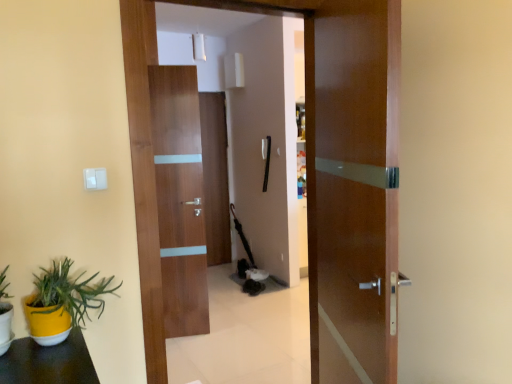
Find the location of a particular element. This screenshot has width=512, height=384. glossy wood door at center, which ranks as the 4th door in back-to-front order is located at coordinates (353, 188).

Measure the distance between point (11, 332) and camera.

A distance of 1.43 meters exists between point (11, 332) and camera.

At what (x,y) coordinates should I click in order to perform the action: click on yellow matte flowerpot at lower left. Please return your answer as a coordinate pair (x, y). The height and width of the screenshot is (384, 512). Looking at the image, I should click on (5, 326).

I want to click on wooden door at center, which is counted as the third door, starting from the back, so click(x=348, y=176).

Describe the element at coordinates (180, 198) in the screenshot. I see `walnut wood door at center, which appears as the 2th door when viewed from the back` at that location.

The height and width of the screenshot is (384, 512). I want to click on yellow matte pot at lower left, so click(x=63, y=302).

Where is `matte wood door at center, positioned as the 4th door in front-to-back order`? The height and width of the screenshot is (384, 512). matte wood door at center, positioned as the 4th door in front-to-back order is located at coordinates (215, 177).

Where is `glossy wood door at center, which ranks as the 4th door in back-to-front order`? This screenshot has height=384, width=512. glossy wood door at center, which ranks as the 4th door in back-to-front order is located at coordinates (353, 188).

Looking at this image, is walnut wood door at center, which appears as the 2th door when viewed from the back, facing away from matte wood door at center, which ranks as the first door in back-to-front order?

walnut wood door at center, which appears as the 2th door when viewed from the back, does not have its back to matte wood door at center, which ranks as the first door in back-to-front order.

In the scene shown: Is walnut wood door at center, acting as the third door starting from the front, in front of matte wood door at center, positioned as the 4th door in front-to-back order?

That is True.

Between walnut wood door at center, acting as the third door starting from the front, and matte wood door at center, which ranks as the first door in back-to-front order, which one appears on the left side from the viewer's perspective?

walnut wood door at center, acting as the third door starting from the front, is more to the left.

Which of these two, glossy wood door at center, which ranks as the 4th door in back-to-front order, or yellow matte flowerpot at lower left, is smaller?

yellow matte flowerpot at lower left is smaller.

Does glossy wood door at center, which ranks as the 4th door in back-to-front order, appear on the left side of yellow matte flowerpot at lower left?

No.

Looking at this image, who is shorter, glossy wood door at center, which ranks as the 4th door in back-to-front order, or yellow matte flowerpot at lower left?

Standing shorter between the two is yellow matte flowerpot at lower left.

From a real-world perspective, who is located higher, glossy wood door at center, arranged as the first door when viewed from the front, or yellow matte flowerpot at lower left?

From a 3D spatial view, glossy wood door at center, arranged as the first door when viewed from the front, is above.

In the image, is matte wood door at center, which ranks as the first door in back-to-front order, on the left side or the right side of wooden door at center, which is counted as the third door, starting from the back?

Based on their positions, matte wood door at center, which ranks as the first door in back-to-front order, is located to the left of wooden door at center, which is counted as the third door, starting from the back.

Which point is more distant from viewer, [209,207] or [355,29]?

Point [209,207]

From the image's perspective, relative to wooden door at center, which is counted as the third door, starting from the back, is matte wood door at center, which ranks as the first door in back-to-front order, above or below?

matte wood door at center, which ranks as the first door in back-to-front order, is situated higher than wooden door at center, which is counted as the third door, starting from the back, in the image.

Considering the relative sizes of matte wood door at center, which ranks as the first door in back-to-front order, and wooden door at center, which is counted as the third door, starting from the back, in the image provided, is matte wood door at center, which ranks as the first door in back-to-front order, shorter than wooden door at center, which is counted as the third door, starting from the back,?

No, matte wood door at center, which ranks as the first door in back-to-front order, is not shorter than wooden door at center, which is counted as the third door, starting from the back.

Looking at this image, considering the relative positions of yellow matte pot at lower left and wooden door at center, the 2th door in the front-to-back sequence, in the image provided, is yellow matte pot at lower left to the right of wooden door at center, the 2th door in the front-to-back sequence, from the viewer's perspective?

No.

In the scene shown: Which object is wider, yellow matte pot at lower left or wooden door at center, which is counted as the third door, starting from the back?

Wider between the two is yellow matte pot at lower left.

How different are the orientations of yellow matte pot at lower left and wooden door at center, the 2th door in the front-to-back sequence, in degrees?

The facing directions of yellow matte pot at lower left and wooden door at center, the 2th door in the front-to-back sequence, are 1.27 degrees apart.

Between yellow matte pot at lower left and wooden door at center, which is counted as the third door, starting from the back, which one has more height?

Standing taller between the two is wooden door at center, which is counted as the third door, starting from the back.

Would you say glossy wood door at center, which ranks as the 4th door in back-to-front order, is outside matte wood door at center, which ranks as the first door in back-to-front order?

Yes, glossy wood door at center, which ranks as the 4th door in back-to-front order, is outside of matte wood door at center, which ranks as the first door in back-to-front order.

From the image's perspective, is glossy wood door at center, arranged as the first door when viewed from the front, on matte wood door at center, positioned as the 4th door in front-to-back order?

No, from the image's perspective, glossy wood door at center, arranged as the first door when viewed from the front, is not on top of matte wood door at center, positioned as the 4th door in front-to-back order.

Considering the sizes of objects glossy wood door at center, arranged as the first door when viewed from the front, and matte wood door at center, positioned as the 4th door in front-to-back order, in the image provided, who is taller, glossy wood door at center, arranged as the first door when viewed from the front, or matte wood door at center, positioned as the 4th door in front-to-back order,?

matte wood door at center, positioned as the 4th door in front-to-back order.

In the scene shown: How distant is glossy wood door at center, which ranks as the 4th door in back-to-front order, from matte wood door at center, positioned as the 4th door in front-to-back order?

glossy wood door at center, which ranks as the 4th door in back-to-front order, is 3.45 meters away from matte wood door at center, positioned as the 4th door in front-to-back order.

Are yellow matte flowerpot at lower left and wooden door at center, which is counted as the third door, starting from the back, located far from each other?

Yes.

Which door is the 1st one when counting from the back of the yellow matte flowerpot at lower left? Please provide its 2D coordinates.

[(348, 176)]

Which is closer to the camera, [7,307] or [384,379]?

Point [7,307].

From a real-world perspective, who is located lower, glossy wood door at center, arranged as the first door when viewed from the front, or walnut wood door at center, which appears as the 2th door when viewed from the back?

walnut wood door at center, which appears as the 2th door when viewed from the back, is physically lower.

Is there a large distance between glossy wood door at center, which ranks as the 4th door in back-to-front order, and walnut wood door at center, which appears as the 2th door when viewed from the back?

Yes, glossy wood door at center, which ranks as the 4th door in back-to-front order, is far from walnut wood door at center, which appears as the 2th door when viewed from the back.

Does glossy wood door at center, arranged as the first door when viewed from the front, have a larger size compared to walnut wood door at center, acting as the third door starting from the front?

Correct, glossy wood door at center, arranged as the first door when viewed from the front, is larger in size than walnut wood door at center, acting as the third door starting from the front.

Where is `the 2nd door below the matte wood door at center, which ranks as the first door in back-to-front order (from the image's perspective)`? The width and height of the screenshot is (512, 384). the 2nd door below the matte wood door at center, which ranks as the first door in back-to-front order (from the image's perspective) is located at coordinates (180, 198).

This screenshot has width=512, height=384. Find the location of `flowerpot behind the glossy wood door at center, which ranks as the 4th door in back-to-front order`. flowerpot behind the glossy wood door at center, which ranks as the 4th door in back-to-front order is located at coordinates (5, 326).

Looking at this image, which object lies nearer to the anchor point wooden door at center, which is counted as the third door, starting from the back, yellow matte pot at lower left or glossy wood door at center, which ranks as the 4th door in back-to-front order?

The object closer to wooden door at center, which is counted as the third door, starting from the back, is glossy wood door at center, which ranks as the 4th door in back-to-front order.

Based on their spatial positions, is walnut wood door at center, which appears as the 2th door when viewed from the back, or wooden door at center, the 2th door in the front-to-back sequence, further from matte wood door at center, which ranks as the first door in back-to-front order?

The object further to matte wood door at center, which ranks as the first door in back-to-front order, is wooden door at center, the 2th door in the front-to-back sequence.

Based on their spatial positions, is yellow matte pot at lower left or matte wood door at center, which ranks as the first door in back-to-front order, further from walnut wood door at center, which appears as the 2th door when viewed from the back?

Based on the image, matte wood door at center, which ranks as the first door in back-to-front order, appears to be further to walnut wood door at center, which appears as the 2th door when viewed from the back.

Looking at this image, based on their spatial positions, is wooden door at center, which is counted as the third door, starting from the back, or yellow matte flowerpot at lower left further from glossy wood door at center, arranged as the first door when viewed from the front?

yellow matte flowerpot at lower left lies further to glossy wood door at center, arranged as the first door when viewed from the front, than the other object.

From the image, which object appears to be farther from yellow matte flowerpot at lower left, matte wood door at center, positioned as the 4th door in front-to-back order, or yellow matte pot at lower left?

The object further to yellow matte flowerpot at lower left is matte wood door at center, positioned as the 4th door in front-to-back order.

Estimate the real-world distances between objects in this image. Which object is further from yellow matte pot at lower left, yellow matte flowerpot at lower left or walnut wood door at center, acting as the third door starting from the front?

walnut wood door at center, acting as the third door starting from the front.

Estimate the real-world distances between objects in this image. Which object is closer to matte wood door at center, which ranks as the first door in back-to-front order, glossy wood door at center, which ranks as the 4th door in back-to-front order, or walnut wood door at center, which appears as the 2th door when viewed from the back?

Among the two, walnut wood door at center, which appears as the 2th door when viewed from the back, is located nearer to matte wood door at center, which ranks as the first door in back-to-front order.

From the image, which object appears to be farther from yellow matte flowerpot at lower left, wooden door at center, which is counted as the third door, starting from the back, or yellow matte pot at lower left?

wooden door at center, which is counted as the third door, starting from the back, is further to yellow matte flowerpot at lower left.

This screenshot has width=512, height=384. I want to click on door located between yellow matte flowerpot at lower left and walnut wood door at center, acting as the third door starting from the front, in the depth direction, so click(348, 176).

What are the coordinates of `houseplant between yellow matte flowerpot at lower left and matte wood door at center, which ranks as the first door in back-to-front order, along the z-axis` in the screenshot? It's located at (63, 302).

The height and width of the screenshot is (384, 512). What are the coordinates of `door between wooden door at center, the 2th door in the front-to-back sequence, and matte wood door at center, positioned as the 4th door in front-to-back order, along the z-axis` in the screenshot? It's located at (180, 198).

Identify the location of door between glossy wood door at center, which ranks as the 4th door in back-to-front order, and walnut wood door at center, acting as the third door starting from the front, in the front-back direction. The height and width of the screenshot is (384, 512). (348, 176).